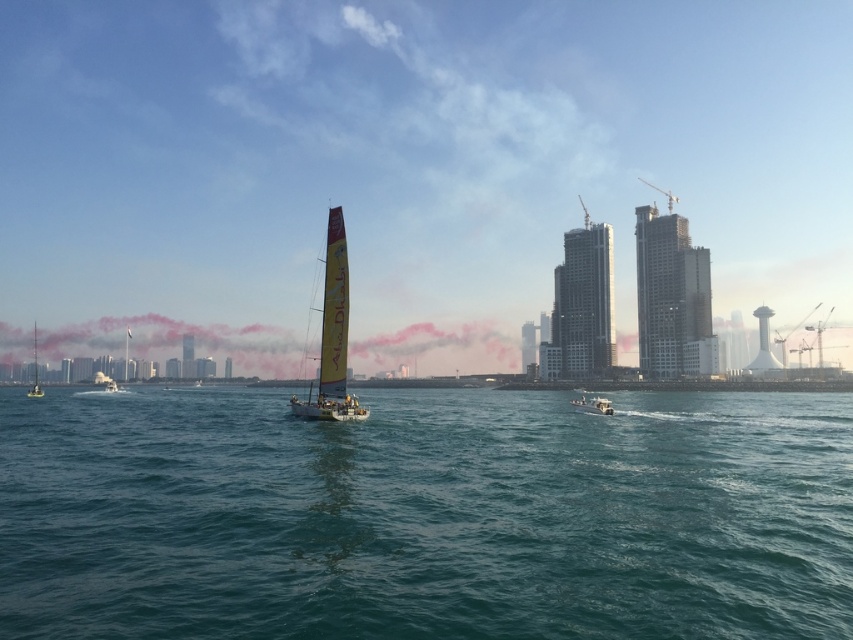
Question: Which of the following is the closest to the observer?

Choices:
 (A) (35, 348)
 (B) (602, 401)

Answer: (B)

Question: From the image, what is the correct spatial relationship of yellow fabric sailboat at center in relation to metallic silver boat at center?

Choices:
 (A) left
 (B) right

Answer: (A)

Question: Does yellow fabric sailboat at center appear over metallic silver boat at center?

Choices:
 (A) no
 (B) yes

Answer: (B)

Question: Which point appears farthest from the camera in this image?

Choices:
 (A) (535, 520)
 (B) (572, 401)
 (C) (32, 392)
 (D) (277, 372)

Answer: (D)

Question: Based on their relative distances, which object is nearer to the yellow fabric sailboat at center?

Choices:
 (A) metallic silver boat at center
 (B) teal water at center
 (C) pink smoke at center

Answer: (B)

Question: Is metallic silver boat at center wider than yellow sailboat at left?

Choices:
 (A) yes
 (B) no

Answer: (B)